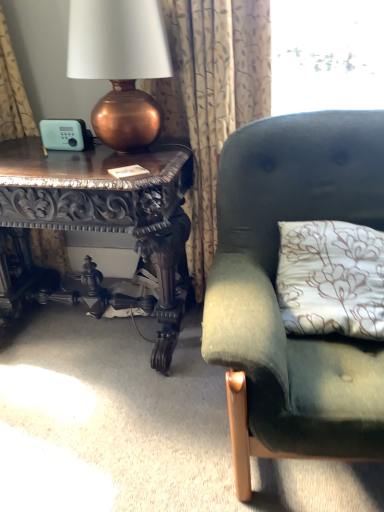
Question: Is carved wood table at left to the left of copper metallic lamp at left from the viewer's perspective?

Choices:
 (A) no
 (B) yes

Answer: (B)

Question: Is carved wood table at left touching copper metallic lamp at left?

Choices:
 (A) no
 (B) yes

Answer: (A)

Question: Does carved wood table at left have a greater width compared to copper metallic lamp at left?

Choices:
 (A) no
 (B) yes

Answer: (B)

Question: From the image's perspective, is carved wood table at left under copper metallic lamp at left?

Choices:
 (A) yes
 (B) no

Answer: (A)

Question: Can copper metallic lamp at left be found inside carved wood table at left?

Choices:
 (A) no
 (B) yes

Answer: (A)

Question: Based on their positions, is velvet green couch at right located to the left or right of patterned fabric curtain at upper left?

Choices:
 (A) left
 (B) right

Answer: (B)

Question: Considering the positions of point (324, 117) and point (241, 39), is point (324, 117) closer or farther from the camera than point (241, 39)?

Choices:
 (A) closer
 (B) farther

Answer: (A)

Question: Based on their sizes in the image, would you say velvet green couch at right is bigger or smaller than patterned fabric curtain at upper left?

Choices:
 (A) small
 (B) big

Answer: (B)

Question: In terms of width, does velvet green couch at right look wider or thinner when compared to patterned fabric curtain at upper left?

Choices:
 (A) thin
 (B) wide

Answer: (B)

Question: From a real-world perspective, relative to carved wood table at left, is velvet green couch at right vertically above or below?

Choices:
 (A) below
 (B) above

Answer: (B)

Question: From the image's perspective, is velvet green couch at right located above or below carved wood table at left?

Choices:
 (A) above
 (B) below

Answer: (B)

Question: Would you say velvet green couch at right is to the left or to the right of carved wood table at left in the picture?

Choices:
 (A) left
 (B) right

Answer: (B)

Question: Do you think velvet green couch at right is within carved wood table at left, or outside of it?

Choices:
 (A) outside
 (B) inside

Answer: (A)

Question: From a real-world perspective, relative to copper metallic lamp at left, is carved wood table at left vertically above or below?

Choices:
 (A) above
 (B) below

Answer: (B)

Question: Do you think carved wood table at left is within copper metallic lamp at left, or outside of it?

Choices:
 (A) inside
 (B) outside

Answer: (B)